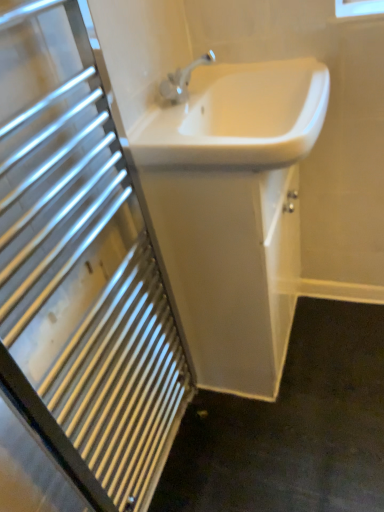
Question: Is white glossy sink at upper center facing towards white glossy sink at center, arranged as the first sink when viewed from the top?

Choices:
 (A) yes
 (B) no

Answer: (B)

Question: Would you say white glossy sink at upper center contains white glossy sink at center, which is the 2th sink from bottom to top?

Choices:
 (A) no
 (B) yes

Answer: (A)

Question: Does white glossy sink at upper center have a lesser height compared to white glossy sink at center, arranged as the first sink when viewed from the top?

Choices:
 (A) yes
 (B) no

Answer: (B)

Question: Is white glossy sink at upper center smaller than white glossy sink at center, arranged as the first sink when viewed from the top?

Choices:
 (A) no
 (B) yes

Answer: (A)

Question: Considering the relative positions of white glossy sink at upper center and white glossy sink at center, arranged as the first sink when viewed from the top, in the image provided, is white glossy sink at upper center to the right of white glossy sink at center, arranged as the first sink when viewed from the top, from the viewer's perspective?

Choices:
 (A) yes
 (B) no

Answer: (B)

Question: Considering the relative sizes of white glossy sink at upper center and white glossy sink at center, arranged as the first sink when viewed from the top, in the image provided, is white glossy sink at upper center wider than white glossy sink at center, arranged as the first sink when viewed from the top,?

Choices:
 (A) yes
 (B) no

Answer: (B)

Question: Is white glossy sink at center, which appears as the 1th sink when ordered from the bottom, wider than white glossy sink at upper center?

Choices:
 (A) yes
 (B) no

Answer: (A)

Question: Is white glossy sink at center, which appears as the 1th sink when ordered from the bottom, facing away from white glossy sink at upper center?

Choices:
 (A) yes
 (B) no

Answer: (B)

Question: Does white glossy sink at center, which appears as the 1th sink when ordered from the bottom, lie behind white glossy sink at upper center?

Choices:
 (A) no
 (B) yes

Answer: (B)

Question: From a real-world perspective, does white glossy sink at center, which appears as the 1th sink when ordered from the bottom, sit lower than white glossy sink at upper center?

Choices:
 (A) no
 (B) yes

Answer: (B)

Question: Is white glossy sink at center, which appears as the 2th sink when viewed from the top, at the left side of white glossy sink at upper center?

Choices:
 (A) no
 (B) yes

Answer: (A)

Question: From the image's perspective, is white glossy sink at center, which appears as the 2th sink when viewed from the top, above white glossy sink at upper center?

Choices:
 (A) yes
 (B) no

Answer: (A)

Question: Is the depth of white glossy sink at center, arranged as the first sink when viewed from the top, greater than that of white glossy sink at upper center?

Choices:
 (A) no
 (B) yes

Answer: (B)